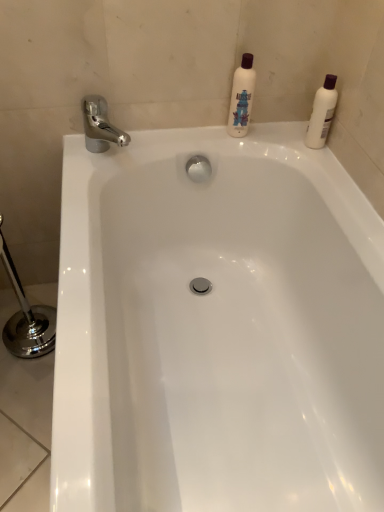
You are a GUI agent. You are given a task and a screenshot of the screen. Output one action in this format:
    pyautogui.click(x=<x>, y=<y>)
    Task: Click on the vacant space situated on the left part of white matte bottle at upper center, which is the 1th cleaning product in left-to-right order
    
    Given the screenshot: What is the action you would take?
    (x=195, y=134)